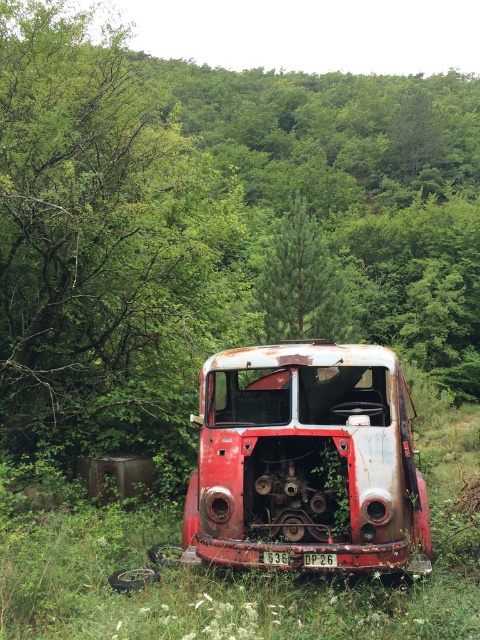
Looking at this image, you are a hiker who has just arrived at the scene of the abandoned red vehicle. You notice the green leafy forest at center and the green grass at center. Which of these two areas is wider?

The green leafy forest at center is wider than the green grass at center.